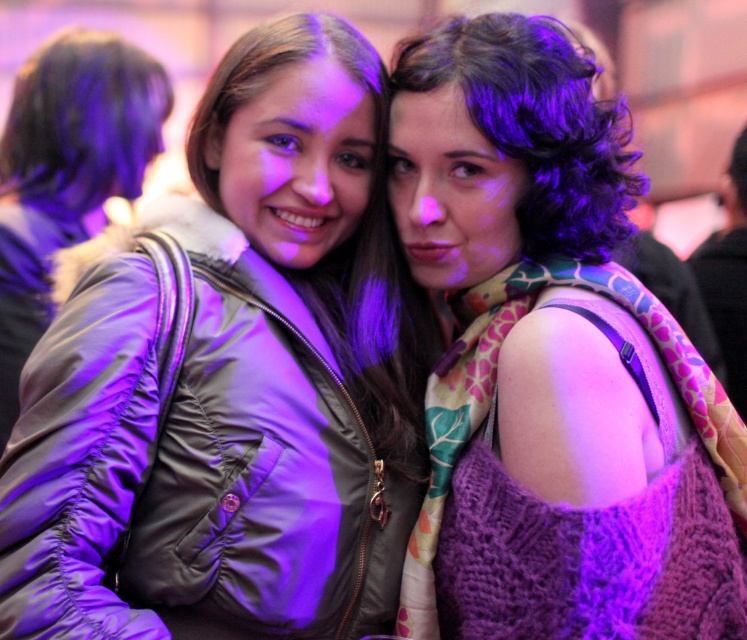
Question: Among these points, which one is farthest from the camera?

Choices:
 (A) (548, 173)
 (B) (288, 307)
 (C) (710, 628)
 (D) (84, 157)

Answer: (D)

Question: Which point appears farthest from the camera in this image?

Choices:
 (A) pyautogui.click(x=158, y=65)
 (B) pyautogui.click(x=68, y=29)
 (C) pyautogui.click(x=356, y=243)

Answer: (B)

Question: Observing the image, what is the correct spatial positioning of knitted purple sweater at center in reference to matte black jacket at left?

Choices:
 (A) left
 (B) right

Answer: (B)

Question: Does matte green jacket at center have a lesser width compared to curly dark brown hair at upper right?

Choices:
 (A) yes
 (B) no

Answer: (B)

Question: Is knitted purple sweater at center below dark brown hair at upper left?

Choices:
 (A) yes
 (B) no

Answer: (A)

Question: Based on their relative distances, which object is nearer to the brownsmoothhair at center?

Choices:
 (A) matte black jacket at left
 (B) knitted purple sweater at center
 (C) curly dark brown hair at upper right
 (D) dark brown hair at upper left

Answer: (B)